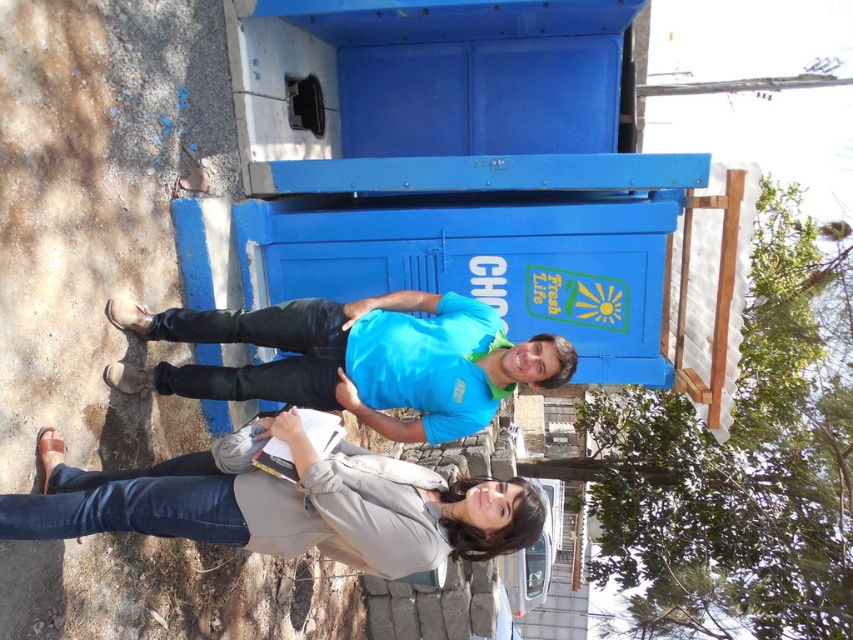
You are a delivery person who needs to place a small package at the location marked by the point. However, there is an object at that point. What is the object at point (286, 506)?

The object at point (286, 506) is the light gray fabric jacket at lower center.

You are a photographer trying to capture a candid shot of the light gray fabric jacket at lower center without being noticed. You have a camera that has a maximum effective range of 10 feet. Can you take the photo from where you are standing?

The light gray fabric jacket at lower center and camera are 11.46 feet apart, which exceeds the camera maximum effective range of 10 feet. Therefore, you cannot take the photo from where you are standing.